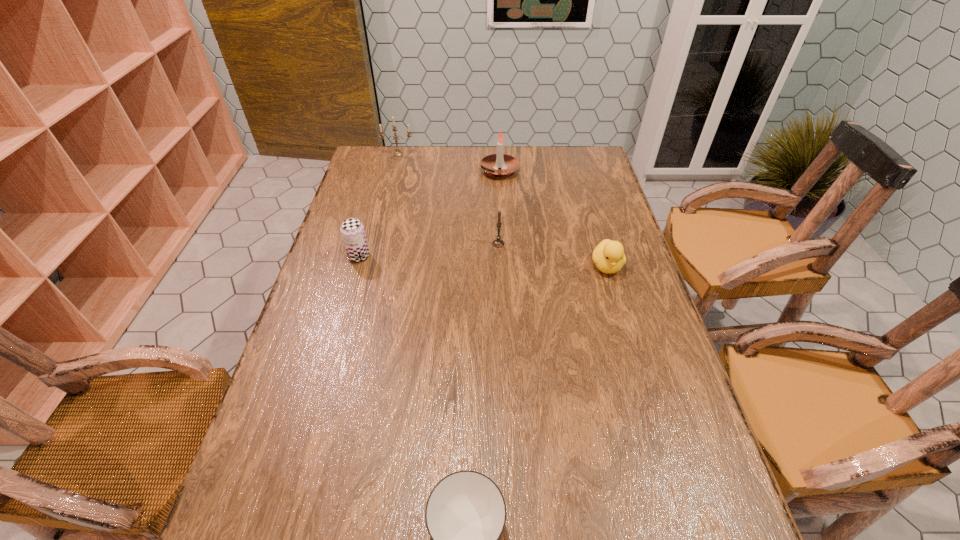
Where is `vacant area that lies between the beer can and the farthest candle`? vacant area that lies between the beer can and the farthest candle is located at coordinates (378, 205).

You are a GUI agent. You are given a task and a screenshot of the screen. Output one action in this format:
    pyautogui.click(x=<x>, y=<y>)
    Task: Click on the free spot between the duck and the leftmost candle
    Image resolution: width=960 pixels, height=540 pixels.
    Given the screenshot: What is the action you would take?
    pyautogui.click(x=502, y=210)

Image resolution: width=960 pixels, height=540 pixels. I want to click on empty space that is in between the fourth nearest object and the beer can, so click(x=429, y=250).

This screenshot has width=960, height=540. In order to click on unoccupied area between the rightmost object and the beer can in this screenshot , I will do `click(483, 261)`.

Find the location of a particular element. This screenshot has width=960, height=540. empty space between the second farthest candle and the nearest candle is located at coordinates (x=499, y=207).

Locate an element on the screen. This screenshot has height=540, width=960. vacant space in between the beer can and the farthest object is located at coordinates (378, 205).

The image size is (960, 540). In order to click on free space between the rightmost object and the nearest candle in this screenshot , I will do `click(552, 255)`.

Image resolution: width=960 pixels, height=540 pixels. Find the location of `vacant area that lies between the second farthest object and the farthest candle`. vacant area that lies between the second farthest object and the farthest candle is located at coordinates (449, 163).

This screenshot has height=540, width=960. I want to click on empty location between the fifth nearest object and the duck, so click(x=553, y=218).

This screenshot has width=960, height=540. I want to click on the closest object to the soup bowl, so click(608, 256).